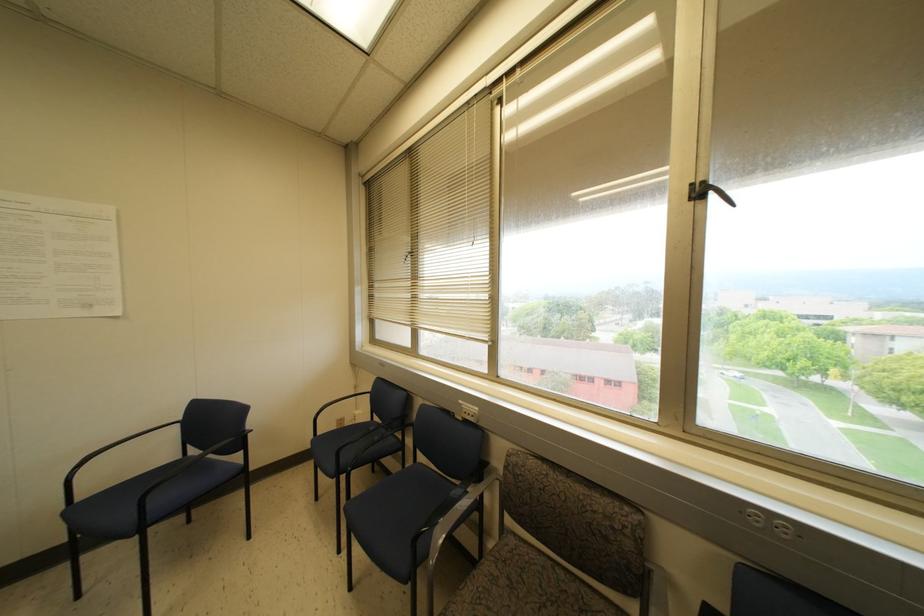
Where is `patterned chair sitting surface`? patterned chair sitting surface is located at coordinates (541, 584).